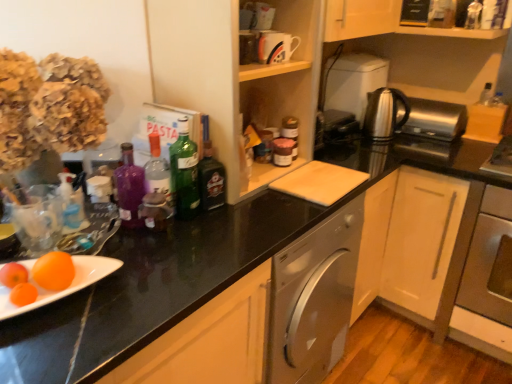
Question: Considering the positions of purple glass bottle at center, which is the 4th bottle in right-to-left order, and satin silver toaster at upper right, which appears as the 1th appliance when viewed from the right, in the image, is purple glass bottle at center, which is the 4th bottle in right-to-left order, wider or thinner than satin silver toaster at upper right, which appears as the 1th appliance when viewed from the right,?

Choices:
 (A) thin
 (B) wide

Answer: (A)

Question: From their relative heights in the image, would you say purple glass bottle at center, the first bottle positioned from the left, is taller or shorter than satin silver toaster at upper right, which is the 3th appliance from left to right?

Choices:
 (A) tall
 (B) short

Answer: (A)

Question: Which object is the closest to the wooden cabinet at upper center?

Choices:
 (A) stainless steel oven at lower right
 (B) satin silver toaster at upper right, which appears as the 1th appliance when viewed from the right
 (C) green glass bottle at center, which ranks as the 2th bottle in right-to-left order
 (D) translucent plastic bottle at center, acting as the third bottle starting from the right
 (E) dark green glass bottle at center, arranged as the 1th bottle when viewed from the right

Answer: (E)

Question: Estimate the real-world distances between objects in this image. Which object is closer to the green glass bottle at center, which is the 3th bottle in left-to-right order?

Choices:
 (A) satin silver toaster at upper right, which is the 3th appliance from left to right
 (B) translucent plastic bottle at center, acting as the third bottle starting from the right
 (C) stainless steel oven at lower right
 (D) glossy ceramic mug at upper center, the first appliance from the left
 (E) dark green glass bottle at center, acting as the 4th bottle starting from the left

Answer: (E)